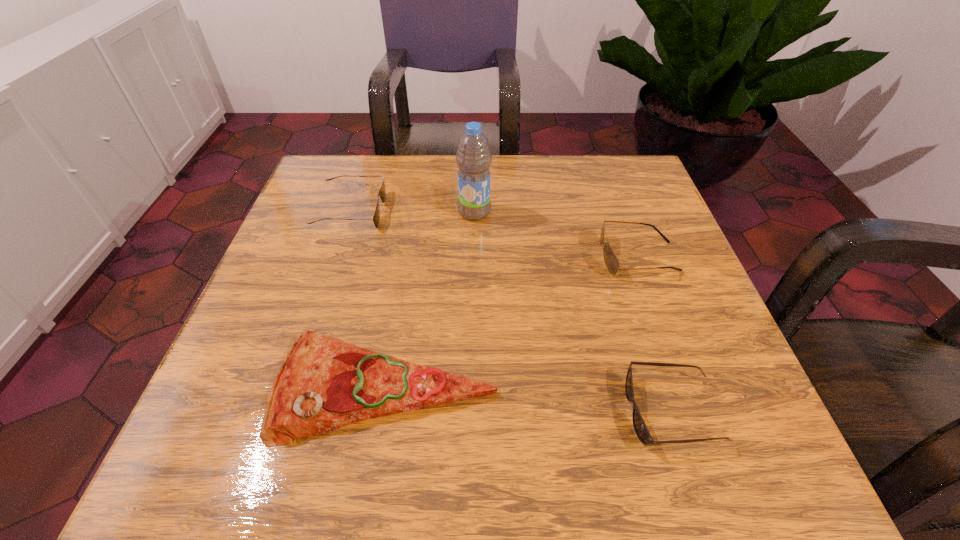
Identify the location of blank space at the near left corner of the desktop. (271, 464).

Where is `vacant space at the far right corner of the desktop`? The height and width of the screenshot is (540, 960). vacant space at the far right corner of the desktop is located at coordinates (611, 188).

Locate an element on the screen. free location at the near right corner of the desktop is located at coordinates (743, 477).

Where is `blank region between the pizza and the tallest object`? The height and width of the screenshot is (540, 960). blank region between the pizza and the tallest object is located at coordinates (430, 300).

Locate an element on the screen. The width and height of the screenshot is (960, 540). free space between the leftmost sunglasses and the pizza is located at coordinates (369, 299).

This screenshot has width=960, height=540. What are the coordinates of `free area in between the water bottle and the second nearest sunglasses` in the screenshot? It's located at (556, 234).

Find the location of a particular element. The image size is (960, 540). free space between the tallest object and the nearest sunglasses is located at coordinates (573, 312).

Identify the location of free point between the nearest sunglasses and the leftmost sunglasses. (512, 311).

Identify the location of vacant region between the tallest sunglasses and the nearest sunglasses. The image size is (960, 540). (655, 334).

Identify the location of free point between the third farthest object and the pizza. (512, 322).